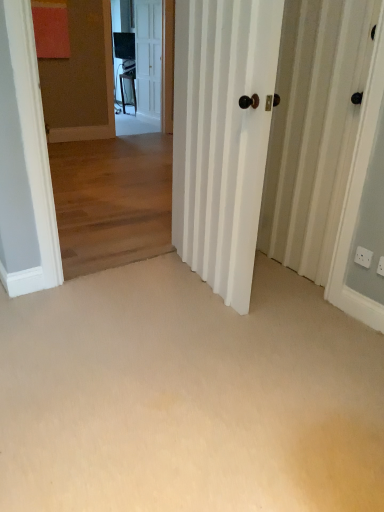
Question: Does white glossy screen door at upper center turn towards white plastic electric outlet at lower right, arranged as the second electric outlet when viewed from the back?

Choices:
 (A) yes
 (B) no

Answer: (A)

Question: Can you confirm if white glossy screen door at upper center is smaller than white plastic electric outlet at lower right, which ranks as the 2th electric outlet in left-to-right order?

Choices:
 (A) yes
 (B) no

Answer: (B)

Question: From a real-world perspective, is white glossy screen door at upper center on top of white plastic electric outlet at lower right, arranged as the second electric outlet when viewed from the back?

Choices:
 (A) yes
 (B) no

Answer: (A)

Question: Is white glossy screen door at upper center at the left side of white plastic electric outlet at lower right, which ranks as the 2th electric outlet in left-to-right order?

Choices:
 (A) no
 (B) yes

Answer: (B)

Question: Is white glossy screen door at upper center shorter than white plastic electric outlet at lower right, which ranks as the 2th electric outlet in left-to-right order?

Choices:
 (A) yes
 (B) no

Answer: (B)

Question: Is white plastic electric outlet at lower right, which ranks as the 2th electric outlet in left-to-right order, situated inside white wooden door at upper center, the 2th door ordered from the bottom, or outside?

Choices:
 (A) inside
 (B) outside

Answer: (B)

Question: Looking at the image, does white plastic electric outlet at lower right, arranged as the 1th electric outlet when viewed from the right, seem bigger or smaller compared to white wooden door at upper center, which appears as the first door when viewed from the left?

Choices:
 (A) big
 (B) small

Answer: (B)

Question: From a real-world perspective, is white plastic electric outlet at lower right, which ranks as the 2th electric outlet in left-to-right order, above or below white wooden door at upper center, arranged as the first door when viewed from the top?

Choices:
 (A) above
 (B) below

Answer: (B)

Question: Is point (380, 269) positioned closer to the camera than point (142, 46)?

Choices:
 (A) closer
 (B) farther

Answer: (A)

Question: Choose the correct answer: Is white glossy screen door at upper center inside white plastic electric outlet at lower right, the 2th electric outlet when ordered from front to back, or outside it?

Choices:
 (A) outside
 (B) inside

Answer: (A)

Question: Looking at their shapes, would you say white glossy screen door at upper center is wider or thinner than white plastic electric outlet at lower right, the 2th electric outlet when ordered from front to back?

Choices:
 (A) thin
 (B) wide

Answer: (B)

Question: Is white glossy screen door at upper center taller or shorter than white plastic electric outlet at lower right, the 2th electric outlet when ordered from front to back?

Choices:
 (A) short
 (B) tall

Answer: (B)

Question: Considering the positions of point (134, 1) and point (365, 253), is point (134, 1) closer or farther from the camera than point (365, 253)?

Choices:
 (A) closer
 (B) farther

Answer: (B)

Question: Considering the positions of point (360, 254) and point (77, 102), is point (360, 254) closer or farther from the camera than point (77, 102)?

Choices:
 (A) closer
 (B) farther

Answer: (A)

Question: In terms of height, does white plastic electric outlet at lower right, the 2th electric outlet when ordered from front to back, look taller or shorter compared to wooden floor at center, acting as the 2th corridor starting from the bottom?

Choices:
 (A) tall
 (B) short

Answer: (B)